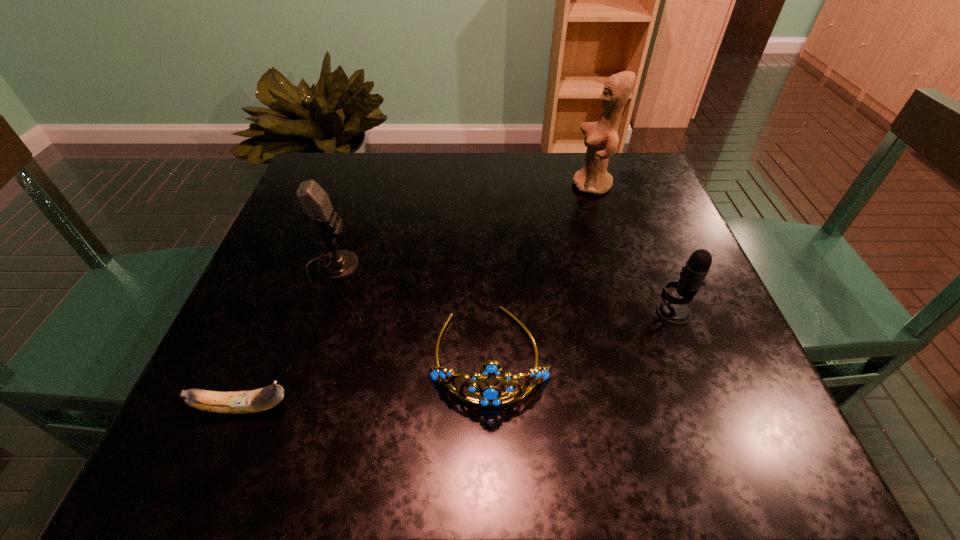
Find the location of a particular element. This screenshot has height=540, width=960. vacant point located between the figurine and the right microphone is located at coordinates (633, 248).

Locate an element on the screen. This screenshot has height=540, width=960. empty location between the shortest object and the third object from left to right is located at coordinates (367, 381).

You are a GUI agent. You are given a task and a screenshot of the screen. Output one action in this format:
    pyautogui.click(x=<x>, y=<y>)
    Task: Click on the empty space that is in between the third tallest object and the farthest object
    
    Given the screenshot: What is the action you would take?
    pyautogui.click(x=633, y=248)

This screenshot has height=540, width=960. In order to click on vacant space in between the third shortest object and the shortest object in this screenshot , I will do `click(459, 360)`.

Locate an element on the screen. The width and height of the screenshot is (960, 540). vacant area that lies between the third tallest object and the shortest object is located at coordinates (459, 360).

What are the coordinates of `vacant area between the shortest object and the left microphone` in the screenshot? It's located at (288, 338).

Identify the location of vacant point located between the third object from right to left and the right microphone. The height and width of the screenshot is (540, 960). (582, 334).

Where is `vacant space that's between the banana and the shorter microphone`? vacant space that's between the banana and the shorter microphone is located at coordinates (459, 360).

The width and height of the screenshot is (960, 540). What are the coordinates of `free space between the tiara and the taller microphone` in the screenshot? It's located at (410, 312).

At what (x,y) coordinates should I click in order to perform the action: click on free area in between the figurine and the shortest object. Please return your answer as a coordinate pair (x, y). This screenshot has width=960, height=540. Looking at the image, I should click on (419, 296).